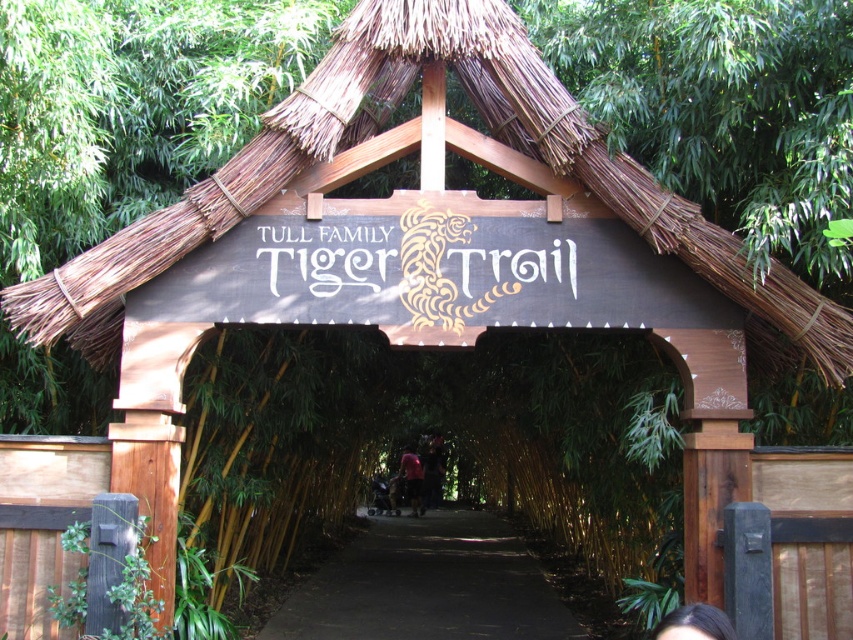
In the scene shown: You are standing at the entrance of the Tull Family Tiger Trail and want to walk towards the dark brown hair at lower center. Which direction should you move relative to the dirt path at center?

The dirt path at center is further away than the dark brown hair at lower center, so to reach the dark brown hair at lower center, you should move towards the direction closer to you compared to the dirt path at center.

From the picture: You are standing at the entrance of the Tull Family Tiger Trail and notice a person with dark brown hair at lower center and a dark brown leather jacket at center. Which object is closer to you?

The dark brown hair at lower center is closer to you because it is in front of the dark brown leather jacket at center.